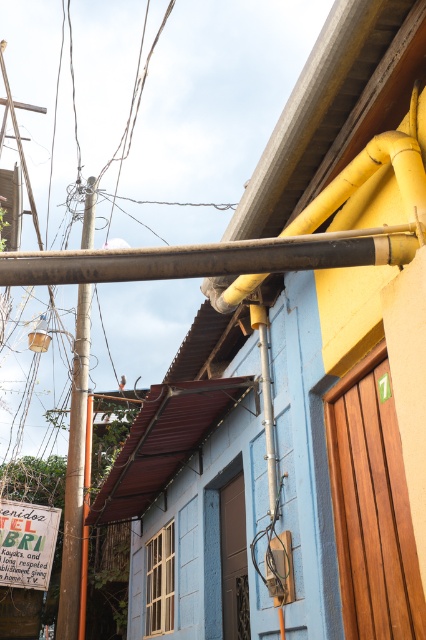
You are a delivery person trying to secure a package on your bike. The package is 1.2 meters long. You notice the black matte pipe at upper center and the smooth brown pole at left. Which object can you safely use to tie the package without it touching the pipe or pole?

The black matte pipe at upper center is smaller than the smooth brown pole at left, so the package can be tied to the smooth brown pole at left since it has a larger diameter and won safety.

You are a delivery person trying to avoid hitting a low hanging object while driving a truck through the street. You see the black matte pipe at upper center. Based on its position coordinates, can you estimate if the pipe is at a safe height for the truck to pass underneath?

The black matte pipe at upper center is positioned at coordinates point (212,257), which does not provide specific height information. Therefore, it is impossible to determine if the pipe is at a safe height for the truck to pass underneath without additional data.